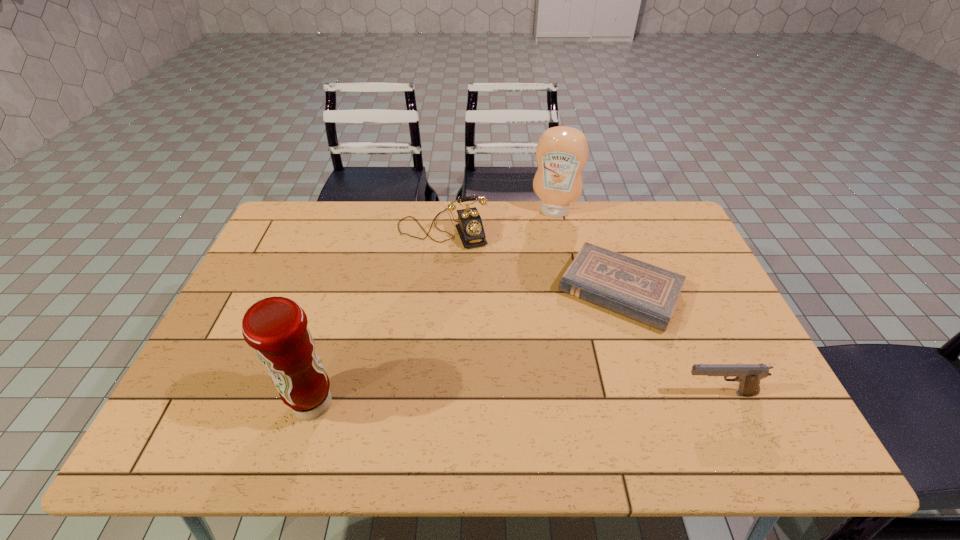
I want to click on vacant space situated at the barrel of the fourth tallest object, so click(x=603, y=394).

At what (x,y) coordinates should I click in order to perform the action: click on vacant space located on the label of the farther condiment. Please return your answer as a coordinate pair (x, y). This screenshot has width=960, height=540. Looking at the image, I should click on (535, 272).

Where is `vacant space located on the label of the farther condiment`? This screenshot has width=960, height=540. vacant space located on the label of the farther condiment is located at coordinates (546, 230).

Locate an element on the screen. Image resolution: width=960 pixels, height=540 pixels. blank space located on the label of the farther condiment is located at coordinates (536, 269).

I want to click on free space located on the dial of the second object from left to right, so click(x=467, y=284).

Find the location of a particular element. free space located on the dial of the second object from left to right is located at coordinates 472,301.

Locate an element on the screen. vacant space located 0.340m on the dial of the second object from left to right is located at coordinates (484, 330).

Where is `vacant point located on the spine side of the third farthest object`? vacant point located on the spine side of the third farthest object is located at coordinates (588, 345).

The width and height of the screenshot is (960, 540). I want to click on vacant space situated on the spine side of the third farthest object, so click(576, 370).

At what (x,y) coordinates should I click in order to perform the action: click on free region located on the spine side of the third farthest object. Please return your answer as a coordinate pair (x, y). Looking at the image, I should click on (564, 392).